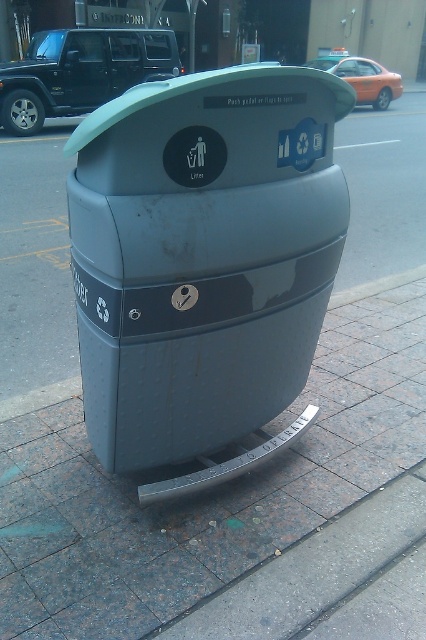
Question: Among these points, which one is farthest from the camera?

Choices:
 (A) (201, 148)
 (B) (340, 49)
 (C) (45, 90)

Answer: (B)

Question: Which point is closer to the camera?

Choices:
 (A) matte gray trash can at center
 (B) orange matte car at upper right
 (C) black matte suv at upper left

Answer: (A)

Question: Does matte gray trash can at center appear under black matte suv at upper left?

Choices:
 (A) yes
 (B) no

Answer: (A)

Question: Observing the image, what is the correct spatial positioning of black matte suv at upper left in reference to orange matte car at upper right?

Choices:
 (A) right
 (B) left

Answer: (B)

Question: Can you confirm if matte gray trash can at center is positioned below orange matte car at upper right?

Choices:
 (A) yes
 (B) no

Answer: (A)

Question: Which object appears closest to the camera in this image?

Choices:
 (A) orange matte car at upper right
 (B) matte gray trash can at center
 (C) black matte suv at upper left

Answer: (B)